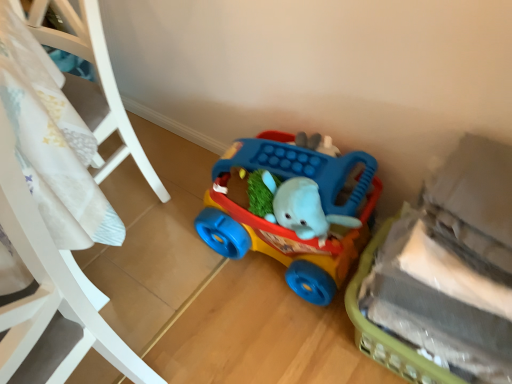
Question: Can you confirm if plush gray elephant at lower right, arranged as the second toy when viewed from the back, is bigger than white plastic crib at left?

Choices:
 (A) yes
 (B) no

Answer: (B)

Question: Does plush gray elephant at lower right, arranged as the second toy when viewed from the back, appear on the left side of white plastic crib at left?

Choices:
 (A) yes
 (B) no

Answer: (B)

Question: Can you confirm if plush gray elephant at lower right, marked as the first toy in a front-to-back arrangement, is taller than white plastic crib at left?

Choices:
 (A) no
 (B) yes

Answer: (A)

Question: From the image's perspective, is plush gray elephant at lower right, marked as the first toy in a front-to-back arrangement, below white plastic crib at left?

Choices:
 (A) yes
 (B) no

Answer: (A)

Question: Is plush gray elephant at lower right, marked as the first toy in a front-to-back arrangement, oriented away from white plastic crib at left?

Choices:
 (A) yes
 (B) no

Answer: (B)

Question: From a real-world perspective, is plush gray elephant at lower right, marked as the first toy in a front-to-back arrangement, beneath white plastic crib at left?

Choices:
 (A) yes
 (B) no

Answer: (A)

Question: Considering the relative sizes of white plastic crib at left and rubberized plastic walker at center, the first toy when ordered from back to front, in the image provided, is white plastic crib at left smaller than rubberized plastic walker at center, the first toy when ordered from back to front,?

Choices:
 (A) no
 (B) yes

Answer: (A)

Question: Is white plastic crib at left at the left side of rubberized plastic walker at center, the first toy when ordered from back to front?

Choices:
 (A) yes
 (B) no

Answer: (A)

Question: Does white plastic crib at left appear on the right side of rubberized plastic walker at center, which is the 2th toy in front-to-back order?

Choices:
 (A) yes
 (B) no

Answer: (B)

Question: Considering the relative sizes of white plastic crib at left and rubberized plastic walker at center, the first toy when ordered from back to front, in the image provided, is white plastic crib at left thinner than rubberized plastic walker at center, the first toy when ordered from back to front,?

Choices:
 (A) yes
 (B) no

Answer: (B)

Question: From the image's perspective, is white plastic crib at left on top of rubberized plastic walker at center, the first toy when ordered from back to front?

Choices:
 (A) yes
 (B) no

Answer: (A)

Question: Is white plastic crib at left positioned with its back to rubberized plastic walker at center, which is the 2th toy in front-to-back order?

Choices:
 (A) yes
 (B) no

Answer: (A)

Question: Considering the relative sizes of white plastic crib at left and plush gray elephant at lower right, arranged as the second toy when viewed from the back, in the image provided, is white plastic crib at left thinner than plush gray elephant at lower right, arranged as the second toy when viewed from the back,?

Choices:
 (A) no
 (B) yes

Answer: (A)